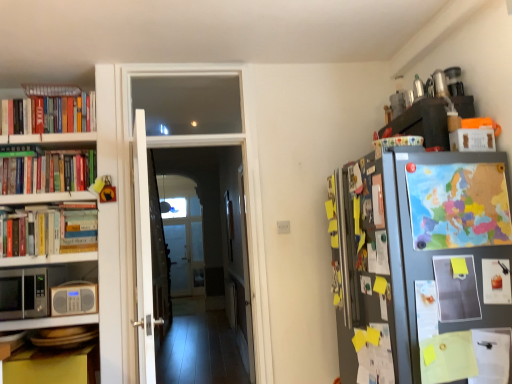
I want to click on free region under hardcover books at left, the 4th book viewed from the right (from a real-world perspective), so click(x=42, y=188).